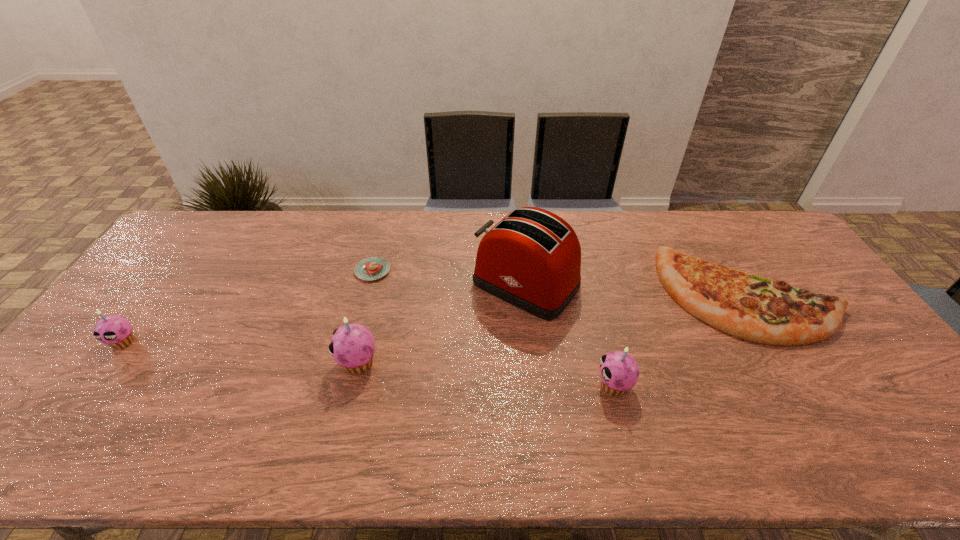
What are the coordinates of `the fourth tallest object` in the screenshot? It's located at (115, 331).

Find the location of a particular element. This screenshot has height=540, width=960. the leftmost cupcake is located at coordinates (115, 331).

This screenshot has height=540, width=960. Identify the location of the second cupcake from right to left. (352, 346).

You are a GUI agent. You are given a task and a screenshot of the screen. Output one action in this format:
    pyautogui.click(x=<x>, y=<y>)
    Task: Click on the third tallest object
    
    Given the screenshot: What is the action you would take?
    point(619,371)

Locate an element on the screen. the second shortest cupcake is located at coordinates (619, 371).

This screenshot has height=540, width=960. I want to click on the shortest object, so click(372, 268).

The image size is (960, 540). Find the location of `the second shortest object`. the second shortest object is located at coordinates (750, 307).

Identify the location of pizza. The width and height of the screenshot is (960, 540). (750, 307).

Where is `the tallest object`? This screenshot has height=540, width=960. the tallest object is located at coordinates (531, 259).

The width and height of the screenshot is (960, 540). In order to click on vacant space positioned 0.100m on the face of the shortest cupcake in this screenshot , I will do `click(91, 386)`.